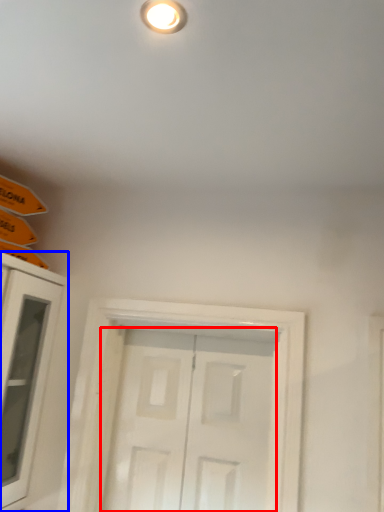
Question: Which point is further to the camera, door (highlighted by a red box) or cabinetry (highlighted by a blue box)?

Choices:
 (A) door
 (B) cabinetry

Answer: (A)